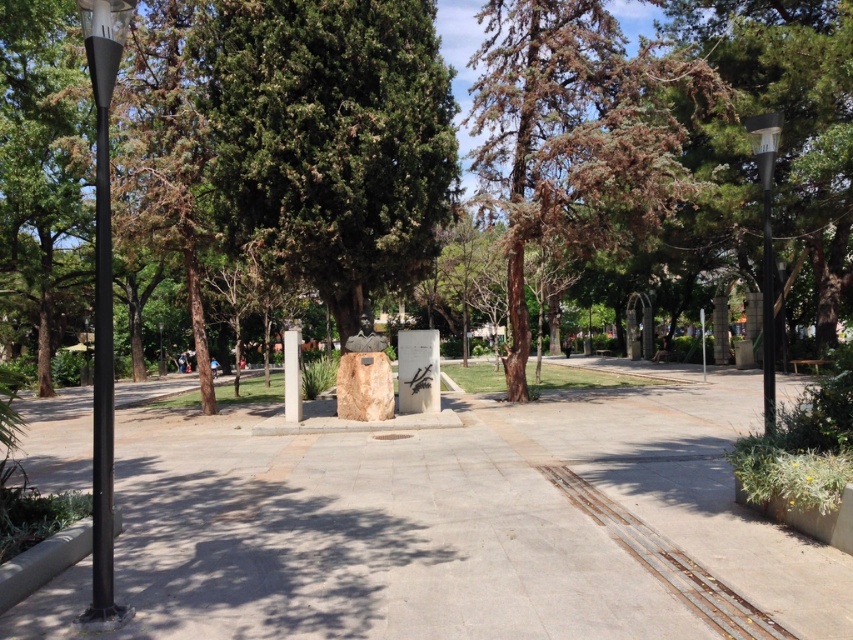
You are a park visitor standing at the entrance and want to walk to the monument. You see the gray concrete pavement at center and the green textured tree at center. Which path should you take to reach the monument?

The gray concrete pavement at center is bigger than the green textured tree at center, so you should take the gray concrete pavement at center path to reach the monument.